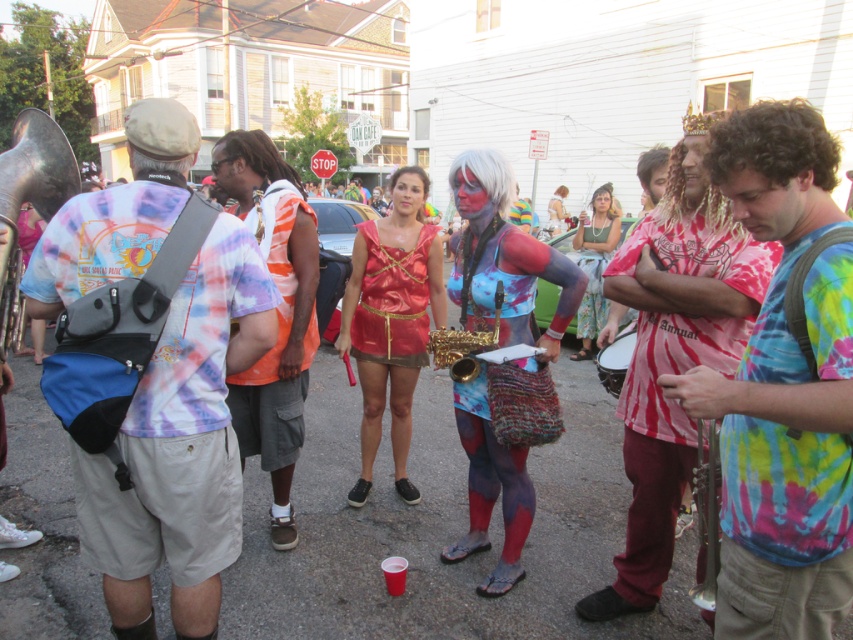
Does silver metallic trombone at lower right appear on the left side of matte drum at center?

Yes, silver metallic trombone at lower right is to the left of matte drum at center.

This screenshot has width=853, height=640. What do you see at coordinates (706, 513) in the screenshot? I see `silver metallic trombone at lower right` at bounding box center [706, 513].

Find the location of a particular element. The image size is (853, 640). silver metallic trombone at lower right is located at coordinates (706, 513).

In order to click on shiny red fabric dress at center in this screenshot , I will do `click(392, 321)`.

Between point (395, 456) and point (459, 332), which one is positioned behind?

Point (395, 456)

Where is `shiny red fabric dress at center`? Image resolution: width=853 pixels, height=640 pixels. shiny red fabric dress at center is located at coordinates (392, 321).

Is tie-dye fabric backpack at left positioned in front of tie-dye fabric body paint at center?

Yes.

Does tie-dye fabric backpack at left have a lesser width compared to tie-dye fabric body paint at center?

Incorrect, tie-dye fabric backpack at left's width is not less than tie-dye fabric body paint at center's.

Identify the location of tie-dye fabric backpack at left. This screenshot has width=853, height=640. 180,445.